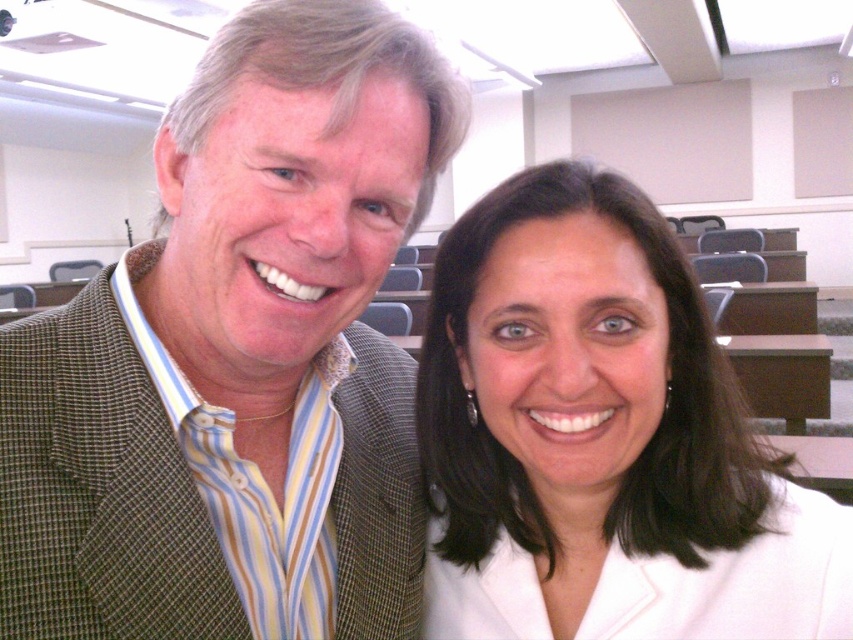
Question: Does green plaid blazer at left appear over white glossy blazer at center?

Choices:
 (A) no
 (B) yes

Answer: (B)

Question: Among these objects, which one is farthest from the camera?

Choices:
 (A) white glossy blazer at center
 (B) green plaid blazer at left

Answer: (A)

Question: Is green plaid blazer at left positioned before white glossy blazer at center?

Choices:
 (A) yes
 (B) no

Answer: (A)

Question: Does green plaid blazer at left appear on the left side of white glossy blazer at center?

Choices:
 (A) no
 (B) yes

Answer: (B)